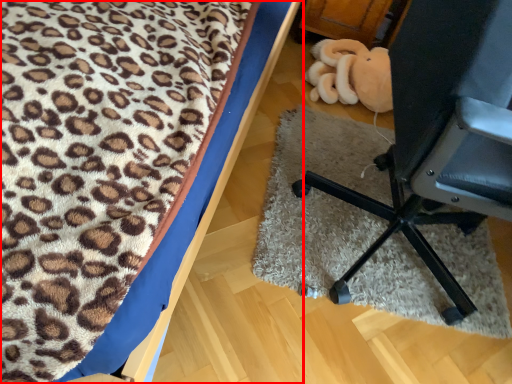
Question: From the image, what is the correct spatial relationship of furniture (annotated by the red box) in relation to furniture?

Choices:
 (A) left
 (B) right

Answer: (A)